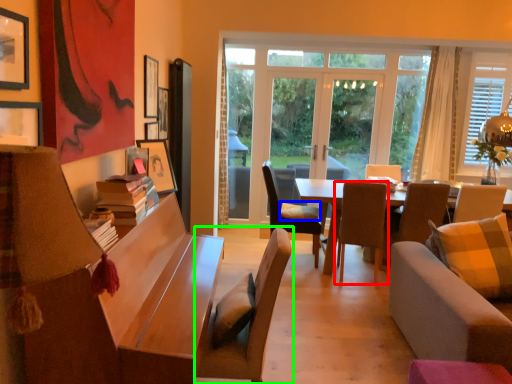
Question: Which object is the farthest from chair (highlighted by a red box)? Choose among these: pillow (highlighted by a blue box) or chair (highlighted by a green box).

Choices:
 (A) pillow
 (B) chair

Answer: (B)